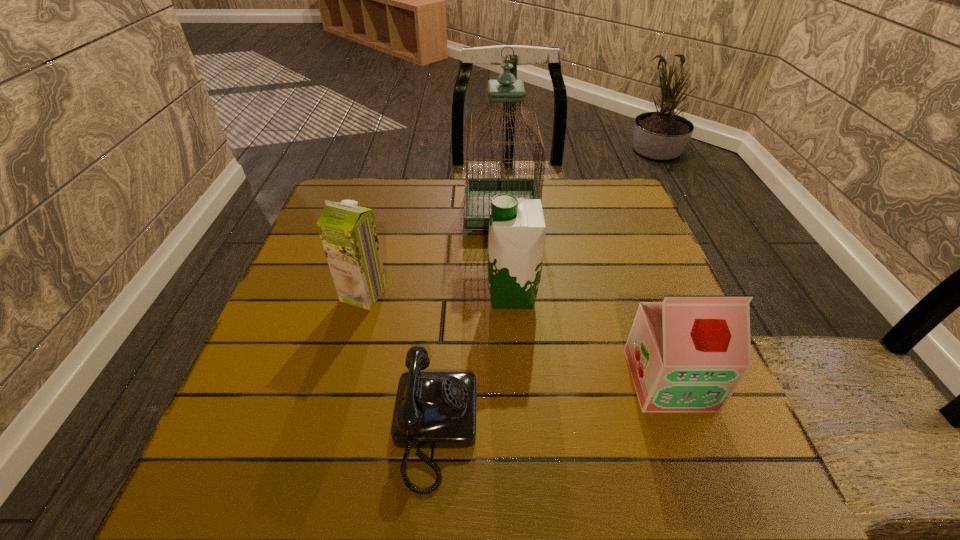
Identify the location of vacant space in between the farthest object and the nearest soya milk. (586, 297).

I want to click on vacant region between the second soya milk from right to left and the shortest object, so click(x=474, y=362).

This screenshot has height=540, width=960. I want to click on free space that is in between the leftmost object and the shortest object, so click(399, 361).

In order to click on unoccupied area between the shortest object and the birdcage in this screenshot , I will do `click(468, 322)`.

Identify the location of object that is the second nearest to the second soya milk from left to right. Image resolution: width=960 pixels, height=540 pixels. (433, 409).

Select which object is the closest to the nearest soya milk. Please provide its 2D coordinates. Your answer should be formatted as a tuple, i.e. [(x, y)], where the tuple contains the x and y coordinates of a point satisfying the conditions above.

[(516, 240)]

Locate which soya milk is the closest to the leftmost soya milk. Please provide its 2D coordinates. Your answer should be formatted as a tuple, i.e. [(x, y)], where the tuple contains the x and y coordinates of a point satisfying the conditions above.

[(516, 240)]

Locate an element on the screen. The width and height of the screenshot is (960, 540). soya milk that is the second closest to the leftmost object is located at coordinates (688, 353).

Identify the location of free space that satisfies the following two spatial constraints: 1. with the cap open on the rightmost soya milk; 2. on the dial of the shortest object. (687, 429).